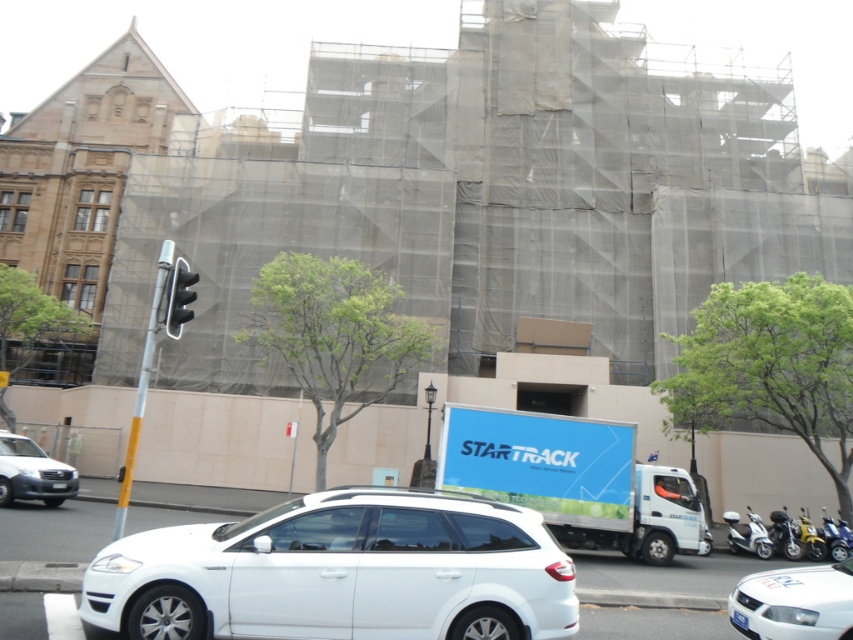
Question: Which point is farther to the camera?

Choices:
 (A) (189, 276)
 (B) (729, 531)
 (C) (782, 625)
 (D) (16, 456)

Answer: (B)

Question: From the image, what is the correct spatial relationship of white matte suv at center in relation to metallic silver scooter at lower right?

Choices:
 (A) above
 (B) below

Answer: (A)

Question: Does white matte suv at center have a larger size compared to metallic silver motorcycle at lower right?

Choices:
 (A) yes
 (B) no

Answer: (B)

Question: Can you confirm if metallic silver scooter at lower right is thinner than metallic silver motorcycle at lower right?

Choices:
 (A) no
 (B) yes

Answer: (B)

Question: Which point is closer to the camera?

Choices:
 (A) (215, 604)
 (B) (831, 570)
 (C) (781, 536)

Answer: (A)

Question: Which object is farther from the camera taking this photo?

Choices:
 (A) white matte suv at center
 (B) white glossy sedan at lower right

Answer: (B)